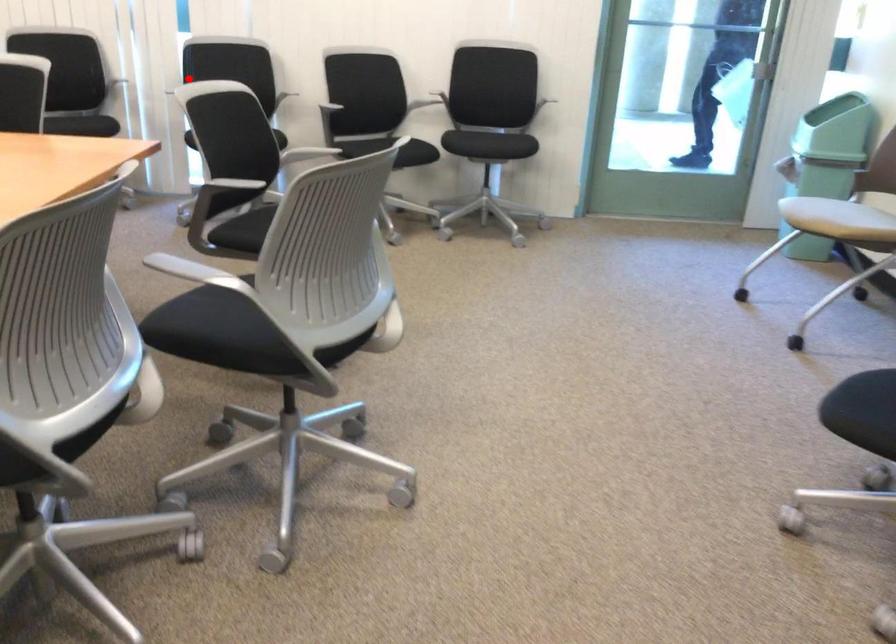
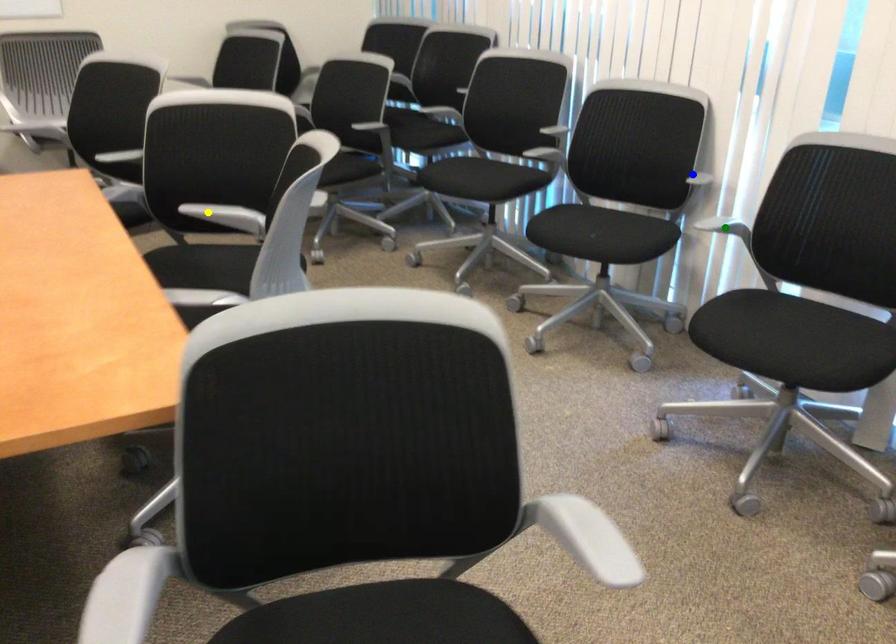
Question: I am providing you with two images of the same scene from different viewpoints. A red point is marked on the first image. You are given multiple points on the second image. In image 2, which mark is for the same physical point as the one in image 1?

Choices:
 (A) blue point
 (B) yellow point
 (C) green point

Answer: (C)